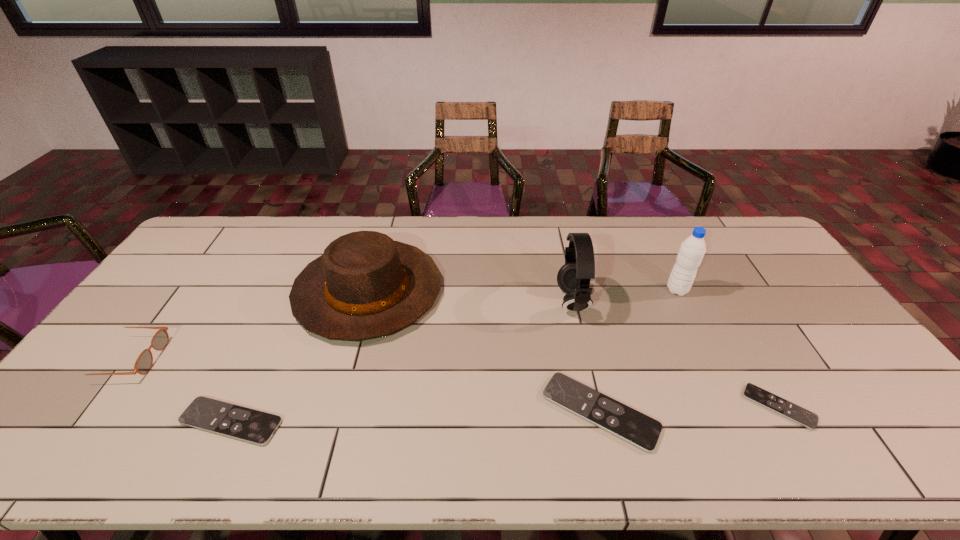
What are the coordinates of `the second shortest remote control` in the screenshot? It's located at (257, 427).

The height and width of the screenshot is (540, 960). What are the coordinates of `the leftmost remote control` in the screenshot? It's located at (257, 427).

I want to click on the second remote control from left to right, so click(x=626, y=423).

At what (x,y) coordinates should I click in order to perform the action: click on the rightmost remote control. Please return your answer as a coordinate pair (x, y). Looking at the image, I should click on (804, 417).

You are a GUI agent. You are given a task and a screenshot of the screen. Output one action in this format:
    pyautogui.click(x=<x>, y=<y>)
    Task: Click on the shortest remote control
    The height and width of the screenshot is (540, 960).
    Given the screenshot: What is the action you would take?
    pyautogui.click(x=804, y=417)

In order to click on earphone in this screenshot , I will do (573, 278).

Find the location of a particular element. water bottle is located at coordinates (692, 250).

Where is `cowboy hat`? This screenshot has width=960, height=540. cowboy hat is located at coordinates (365, 285).

Identify the location of the fourth tallest object. (144, 362).

The width and height of the screenshot is (960, 540). Identify the location of the leftmost object. (144, 362).